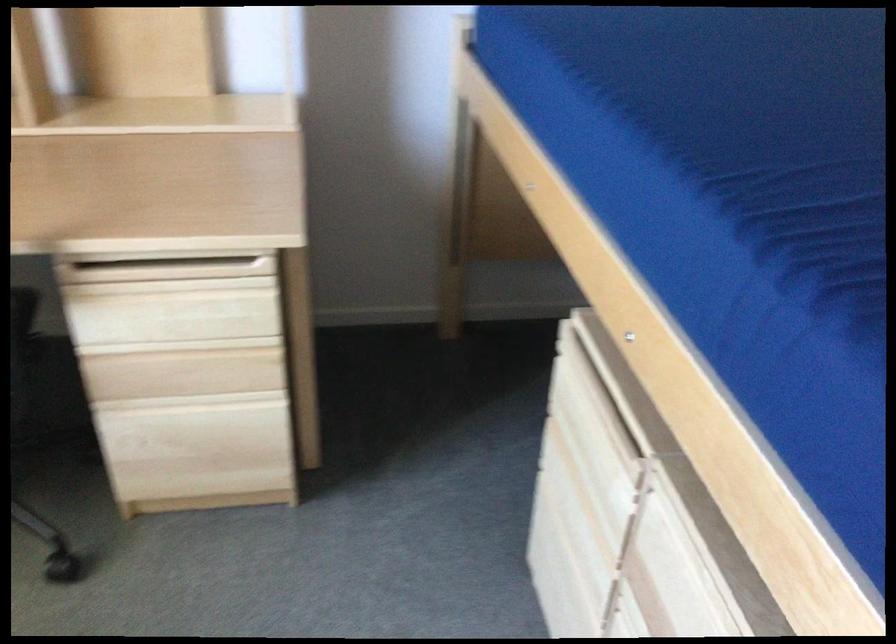
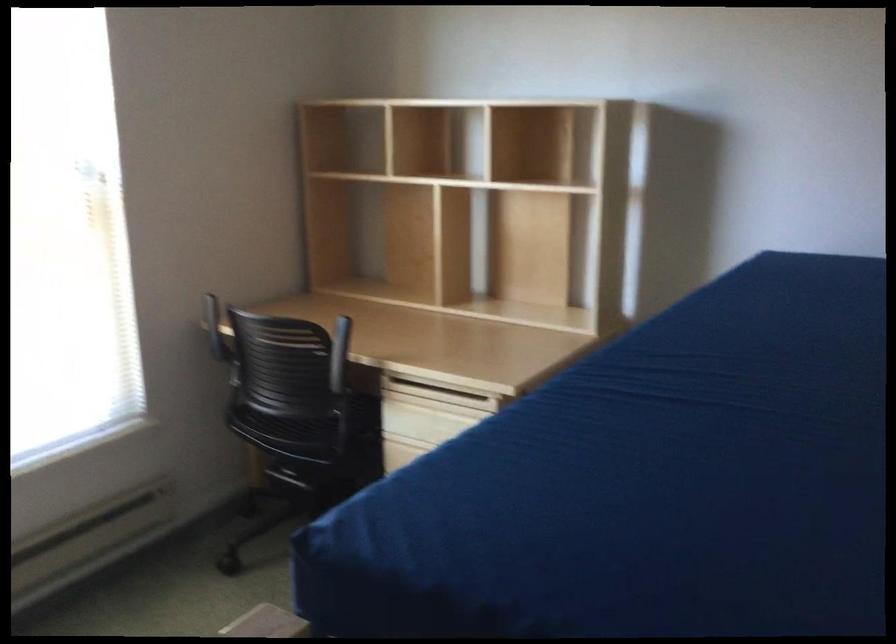
Question: I am providing you with two images of the same scene from different viewpoints. Please identify which objects are invisible in image2.

Choices:
 (A) black chair sitting surface
 (B) plastic bag of nuts
 (C) light wood drawer handle
 (D) black chair armrest

Answer: (C)